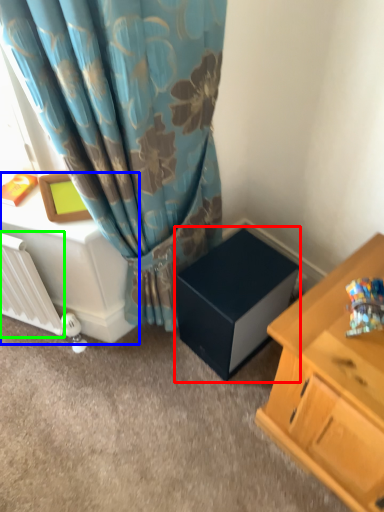
Question: Which is nearer to the cardboard box (highlighted by a red box)? table (highlighted by a blue box) or radiator (highlighted by a green box).

Choices:
 (A) table
 (B) radiator

Answer: (A)